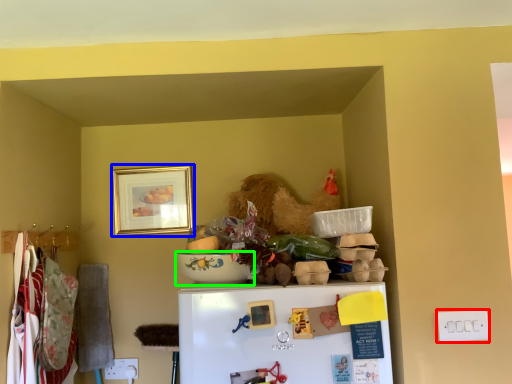
Question: Which is nearer to the electric outlet (highlighted by a red box)? picture frame (highlighted by a blue box) or bowl (highlighted by a green box).

Choices:
 (A) picture frame
 (B) bowl

Answer: (B)